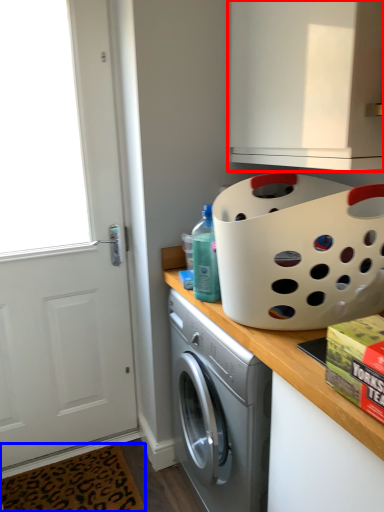
Question: Which object appears closest to the camera in this image, cabinetry (highlighted by a red box) or doormat (highlighted by a blue box)?

Choices:
 (A) cabinetry
 (B) doormat

Answer: (A)